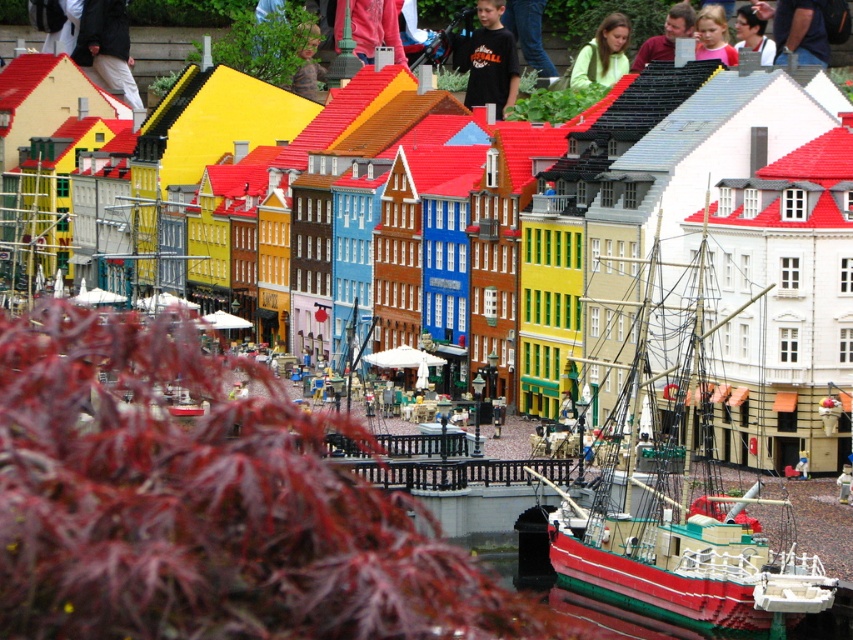
You are a photographer aiming to capture the vibrant miniature town. You notice two shirts displayed at the upper center of the scene. Which shirt would appear larger in your photo if you focus on the matte pink shirt at upper center and the matte black shirt at upper center?

The matte pink shirt at upper center would appear larger in the photo because it is closer to the viewer than the matte black shirt at upper center.

You are a tiny LEGO figure standing at the red leaved bush in the foreground of the miniature town. You see two points marked on the ground ahead of you at coordinates point (730, 65) and point (735, 33). Which point is closer to you?

Point (730, 65) is in front of point (735, 33), so the point (730, 65) is closer to you.